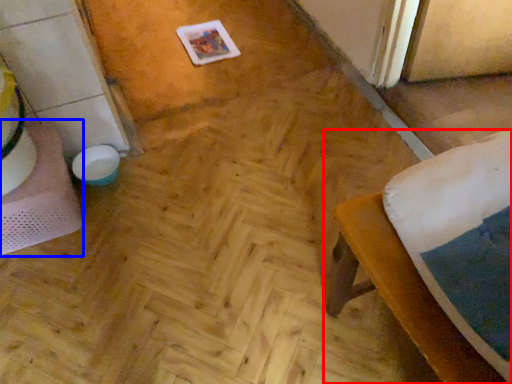
Question: Which of the following is the closest to the observer, furniture (highlighted by a red box) or table (highlighted by a blue box)?

Choices:
 (A) furniture
 (B) table

Answer: (A)